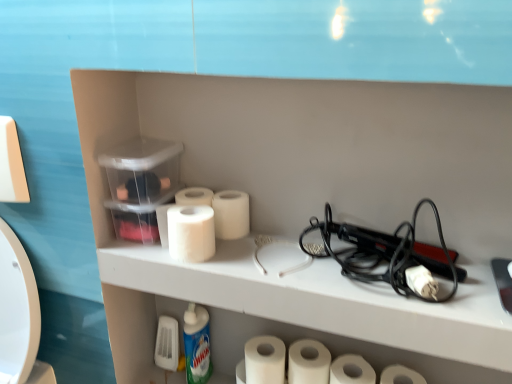
Identify the location of vacant space to the right of white matte toilet paper at center, which ranks as the 1th toilet paper in left-to-right order. The image size is (512, 384). (274, 253).